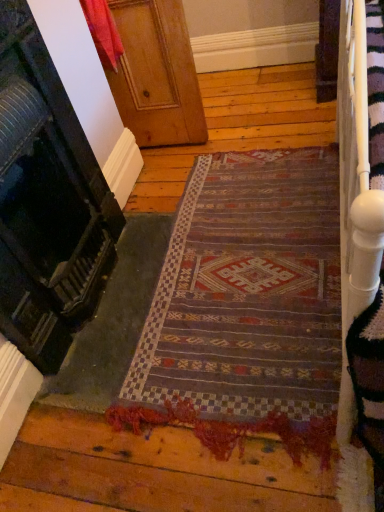
The height and width of the screenshot is (512, 384). I want to click on vacant area that lies to the right of wooden door at upper center, the second door viewed from the top, so click(244, 257).